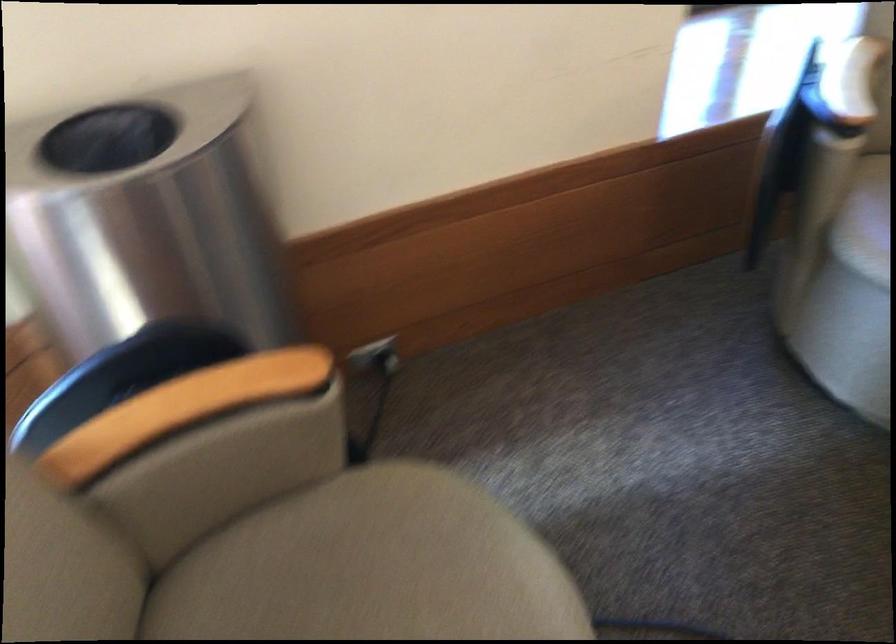
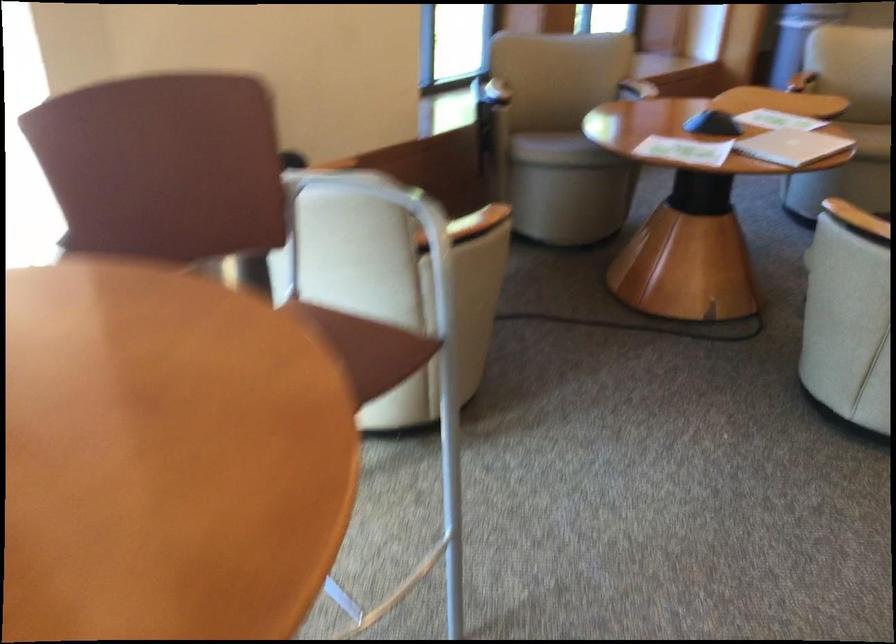
Locate, in the second image, the point that corresponds to point 294,380 in the first image.

(333, 164)